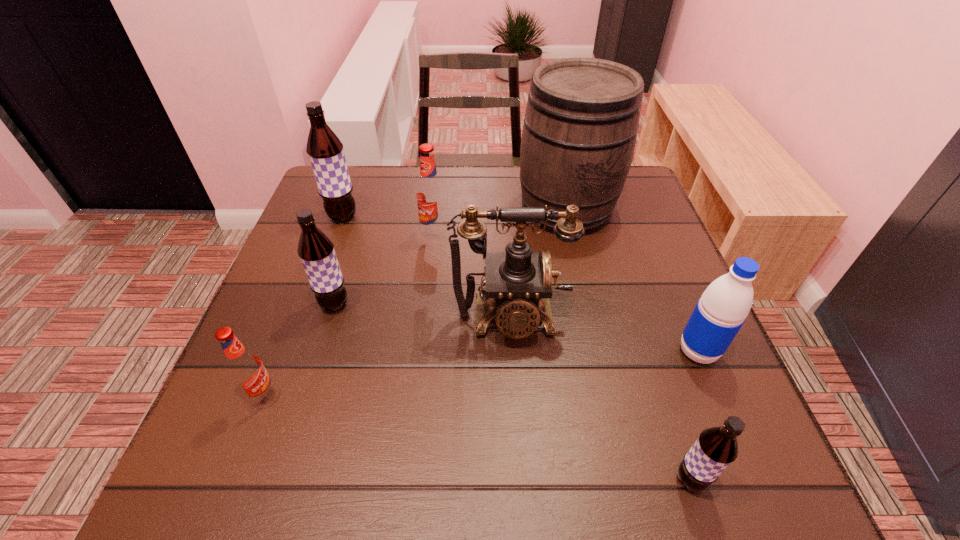
Locate an element on the screen. vacant space located 0.100m on the front of the nearer red root beer is located at coordinates [235, 465].

Identify the location of blank space located on the left of the rightmost brown root beer. This screenshot has width=960, height=540. (589, 480).

The image size is (960, 540). Identify the location of wine bucket that is at the far edge. (581, 122).

At what (x,y) coordinates should I click in order to perform the action: click on root beer that is at the far edge. Please return your answer as a coordinate pair (x, y). Looking at the image, I should click on (325, 150).

Locate an element on the screen. This screenshot has height=540, width=960. object at the near edge is located at coordinates (716, 448).

Identify the location of wine bucket situated at the right edge. (581, 122).

Where is `water bottle that is at the right edge`? water bottle that is at the right edge is located at coordinates (722, 309).

Identify the location of root beer at the right edge. The width and height of the screenshot is (960, 540). (716, 448).

This screenshot has height=540, width=960. I want to click on object at the far left corner, so click(x=325, y=150).

The width and height of the screenshot is (960, 540). In order to click on object at the far right corner in this screenshot , I will do `click(581, 122)`.